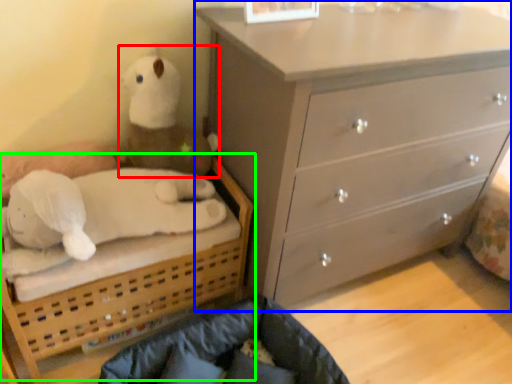
Question: Based on their relative distances, which object is farther from toy (highlighted by a red box)? Choose from chest of drawers (highlighted by a blue box) and bed (highlighted by a green box).

Choices:
 (A) chest of drawers
 (B) bed

Answer: (A)